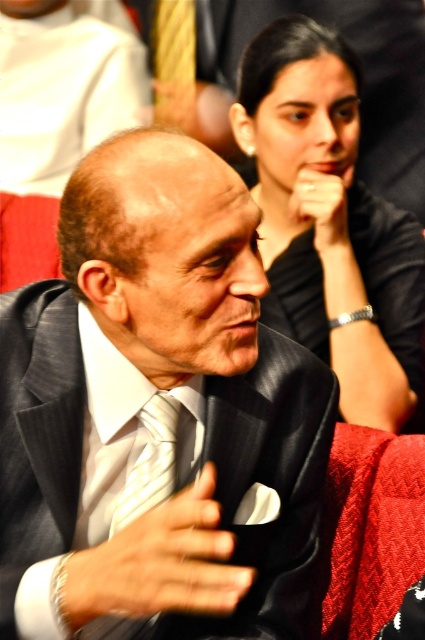
You are a photographer adjusting the camera focus. The camera can only focus on objects within a 30 inch range. Given the black silk dress at upper right and the white striped tie at center are 34.00 inches apart, will both objects be in focus simultaneously?

The black silk dress at upper right and the white striped tie at center are 34.00 inches apart. Since the camera can only focus on objects within a 30 inch range, the distance between them exceeds the focus range. Therefore, both objects cannot be in focus simultaneously.

You are standing at the origin point in the image. Which of the two points, point (362, 232) or point (150, 397), is farther away from you?

Point (362, 232) is farther away from you because it is behind point (150, 397).